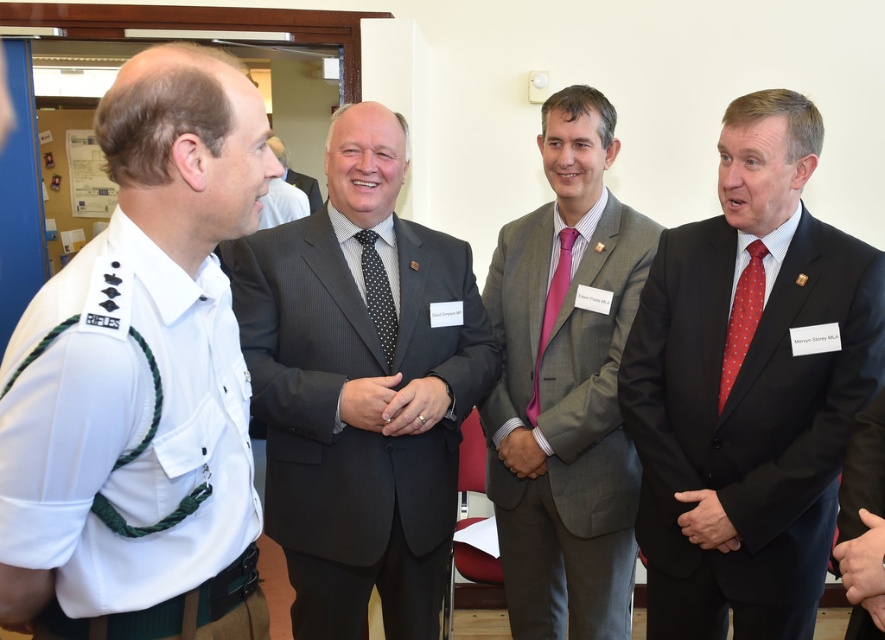
Question: Is white uniform at left smaller than black leather hand at center?

Choices:
 (A) yes
 (B) no

Answer: (B)

Question: Which object is the farthest from the gray textured suit at center?

Choices:
 (A) red dotted tie at right
 (B) black leather hand at center
 (C) black wool suit at right

Answer: (A)

Question: Which object is closer to the camera taking this photo?

Choices:
 (A) black wool suit at right
 (B) dark grey textured suit at center
 (C) black dotted tie at center

Answer: (A)

Question: Based on their relative distances, which object is nearer to the black pinstripe suit at center?

Choices:
 (A) smooth leather hand at center
 (B) white uniform at left

Answer: (A)

Question: Where is black dotted tie at center located in relation to pink silk tie at center in the image?

Choices:
 (A) right
 (B) left

Answer: (B)

Question: Is black pinstripe suit at center to the right of black leather hand at center from the viewer's perspective?

Choices:
 (A) yes
 (B) no

Answer: (B)